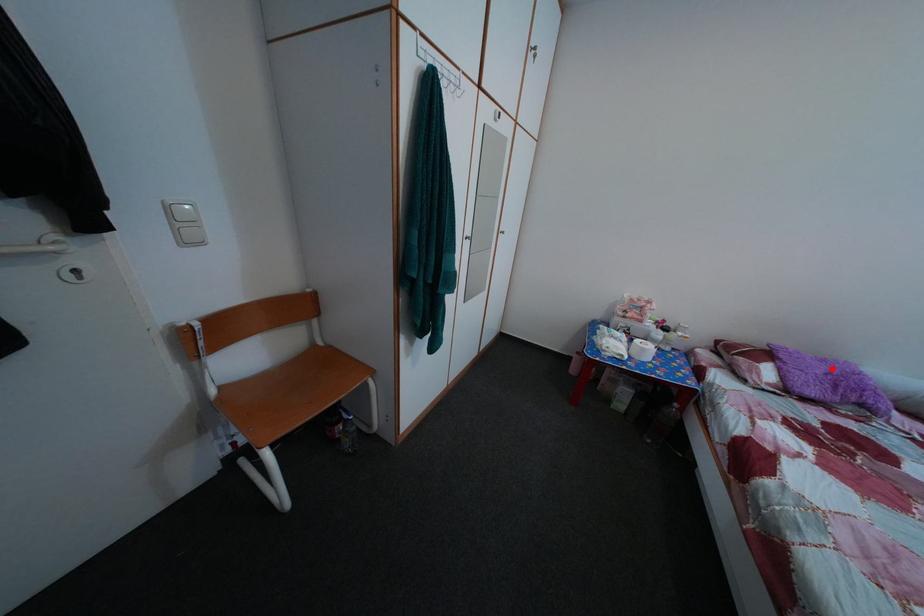
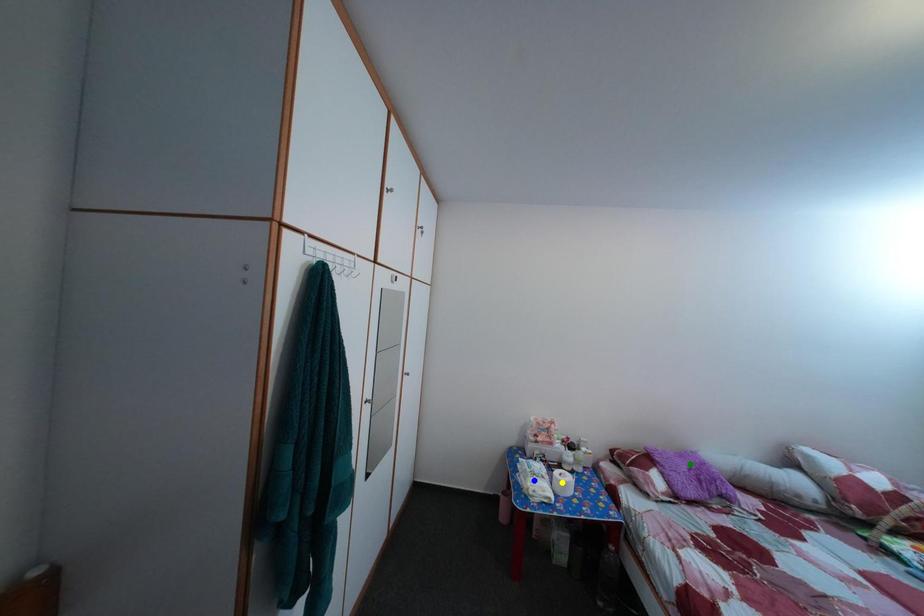
Question: I am providing you with two images of the same scene from different viewpoints. A red point is marked on the first image. You are given multiple points on the second image. Which point in image 2 is actually the same real-world point as the red point in image 1?

Choices:
 (A) yellow point
 (B) blue point
 (C) green point

Answer: (C)